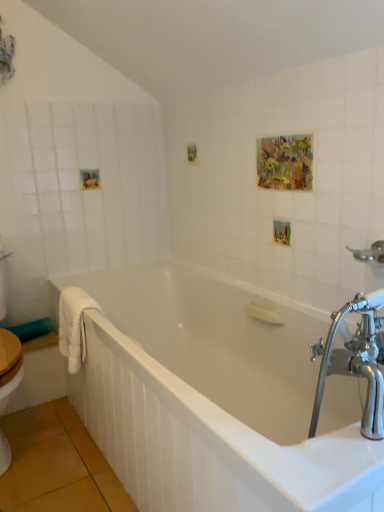
Question: Is white glossy bathtub at center looking in the opposite direction of chrome metallic showerhead at upper right?

Choices:
 (A) no
 (B) yes

Answer: (A)

Question: From the image's perspective, is white glossy bathtub at center under chrome metallic showerhead at upper right?

Choices:
 (A) yes
 (B) no

Answer: (A)

Question: From a real-world perspective, is white glossy bathtub at center physically below chrome metallic showerhead at upper right?

Choices:
 (A) no
 (B) yes

Answer: (B)

Question: Does white glossy bathtub at center come behind chrome metallic showerhead at upper right?

Choices:
 (A) no
 (B) yes

Answer: (A)

Question: Considering the relative positions of white glossy bathtub at center and chrome metallic showerhead at upper right in the image provided, is white glossy bathtub at center to the left of chrome metallic showerhead at upper right from the viewer's perspective?

Choices:
 (A) no
 (B) yes

Answer: (B)

Question: From the image's perspective, does white glossy bathtub at center appear higher than chrome metallic showerhead at upper right?

Choices:
 (A) yes
 (B) no

Answer: (B)

Question: Is chrome metallic showerhead at upper right positioned beyond the bounds of white glossy bathtub at center?

Choices:
 (A) no
 (B) yes

Answer: (B)

Question: Is chrome metallic showerhead at upper right smaller than white glossy bathtub at center?

Choices:
 (A) yes
 (B) no

Answer: (A)

Question: From the image's perspective, is chrome metallic showerhead at upper right on top of white glossy bathtub at center?

Choices:
 (A) no
 (B) yes

Answer: (B)

Question: Does chrome metallic showerhead at upper right appear on the right side of white glossy bathtub at center?

Choices:
 (A) no
 (B) yes

Answer: (B)

Question: Can you confirm if chrome metallic showerhead at upper right is positioned to the left of white glossy bathtub at center?

Choices:
 (A) yes
 (B) no

Answer: (B)

Question: Is chrome metallic showerhead at upper right oriented away from white glossy bathtub at center?

Choices:
 (A) no
 (B) yes

Answer: (A)

Question: Is white fluffy towel at left directly adjacent to chrome metallic showerhead at upper right?

Choices:
 (A) no
 (B) yes

Answer: (A)